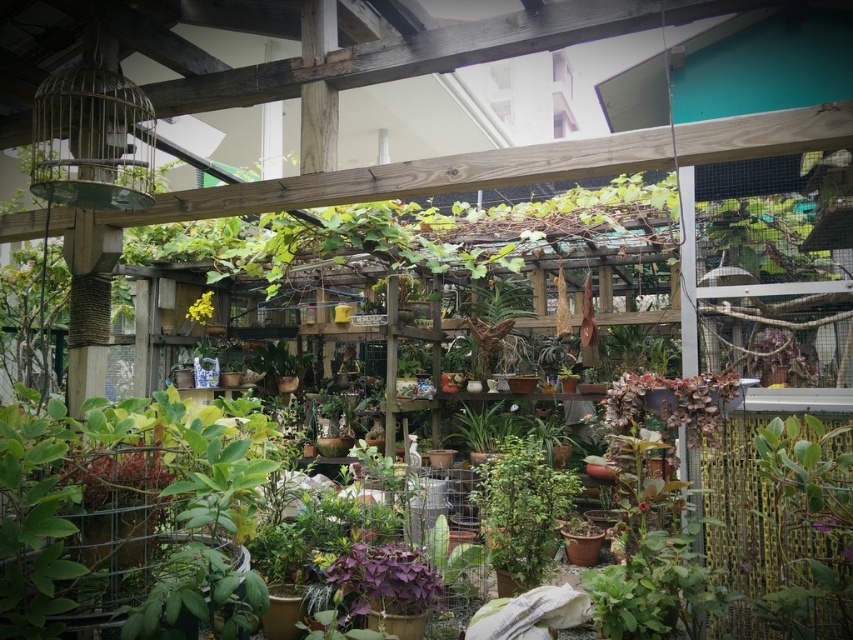
Question: Is green matte plant at center wider than yellow matte flower at center?

Choices:
 (A) yes
 (B) no

Answer: (A)

Question: Is the position of green matte plant at center more distant than that of yellow matte flower at center?

Choices:
 (A) no
 (B) yes

Answer: (A)

Question: Which point is farther from the camera taking this photo?

Choices:
 (A) (509, 477)
 (B) (198, 321)

Answer: (B)

Question: Is green matte plant at center closer to the viewer compared to yellow matte flower at center?

Choices:
 (A) yes
 (B) no

Answer: (A)